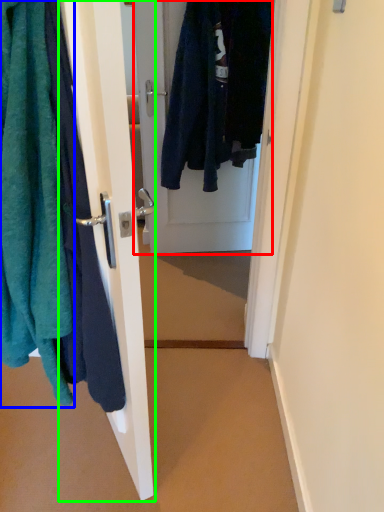
Question: Considering the real-world distances, which object is farthest from door (highlighted by a red box)? towel (highlighted by a blue box) or door (highlighted by a green box)?

Choices:
 (A) towel
 (B) door

Answer: (A)